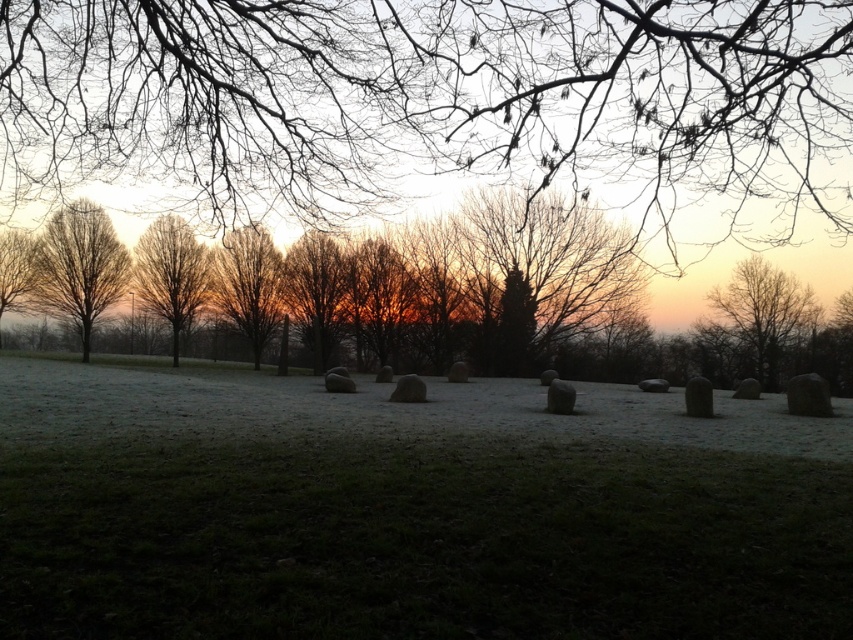
You are standing at the point marked by point (248, 284) in the image. Looking around, you see a brown matte tree at center. What is directly in front of you?

The point (248, 284) marks the brown matte tree at center, so you are standing directly at the location of the brown matte tree at center. Therefore, the brown matte tree at center is directly in front of you.

You are an artist planning to paint the scene. You want to ensure the bare branches at center and the bare wood tree at center are positioned correctly. According to the scene, which one should be placed higher in your painting?

The bare branches at center should be placed higher in the painting because the description states that the bare branches at center is above the bare wood tree at center.